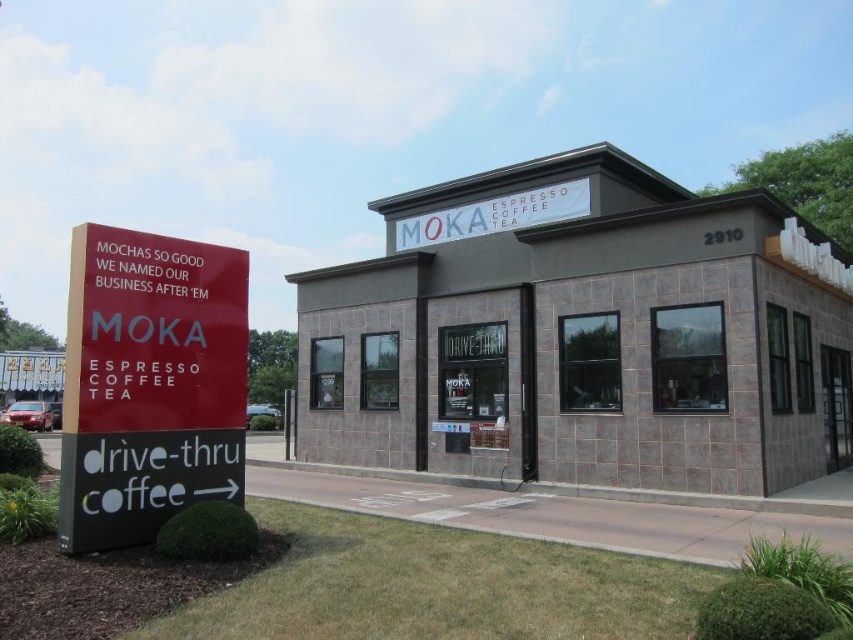
Who is more distant from viewer, (155,532) or (447,228)?

The point (447,228) is behind.

Based on the photo, who is more forward, (148, 340) or (567, 205)?

Point (148, 340) is in front.

Image resolution: width=853 pixels, height=640 pixels. Describe the element at coordinates (149, 384) in the screenshot. I see `red matte sign at left` at that location.

Where is `red matte sign at left`? red matte sign at left is located at coordinates (149, 384).

Is gray stone building at center below red matte sign at left?

No, gray stone building at center is not below red matte sign at left.

Who is more forward, (347, 291) or (142, 340)?

Point (142, 340) is in front.

Is point (668, 268) closer to camera compared to point (68, 420)?

No, (668, 268) is further to viewer.

Find the location of a particular element. The image size is (853, 640). gray stone building at center is located at coordinates (582, 333).

Which is above, gray stone building at center or white fabric sign at upper center?

white fabric sign at upper center

Where is `gray stone building at center`? gray stone building at center is located at coordinates (582, 333).